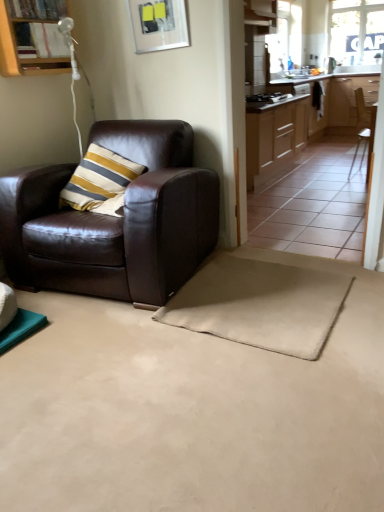
Question: Could you tell me if brown leather chair at right, which is the 2th chair from left to right, is turned towards shiny brown leather armchair at left, marked as the first chair in a bottom-to-top arrangement?

Choices:
 (A) no
 (B) yes

Answer: (A)

Question: From a real-world perspective, does brown leather chair at right, which is the 2th chair from left to right, sit lower than shiny brown leather armchair at left, marked as the first chair in a bottom-to-top arrangement?

Choices:
 (A) yes
 (B) no

Answer: (A)

Question: Does brown leather chair at right, which is the 2th chair from left to right, have a lesser height compared to shiny brown leather armchair at left, placed as the second chair when sorted from top to bottom?

Choices:
 (A) yes
 (B) no

Answer: (B)

Question: Is brown leather chair at right, the 1th chair positioned from the back, facing away from shiny brown leather armchair at left, marked as the first chair in a bottom-to-top arrangement?

Choices:
 (A) yes
 (B) no

Answer: (B)

Question: Is brown leather chair at right, the 2th chair when ordered from front to back, positioned in front of shiny brown leather armchair at left, placed as the second chair when sorted from top to bottom?

Choices:
 (A) yes
 (B) no

Answer: (B)

Question: Can you confirm if brown leather chair at right, which is counted as the 2th chair, starting from the bottom, is bigger than shiny brown leather armchair at left, marked as the first chair in a bottom-to-top arrangement?

Choices:
 (A) yes
 (B) no

Answer: (B)

Question: Considering the relative sizes of wooden cabinet at upper left, the third cabinetry when ordered from back to front, and white glossy sink at upper center in the image provided, is wooden cabinet at upper left, the third cabinetry when ordered from back to front, thinner than white glossy sink at upper center?

Choices:
 (A) no
 (B) yes

Answer: (B)

Question: Does wooden cabinet at upper left, which appears as the 1th cabinetry when viewed from the front, appear on the left side of white glossy sink at upper center?

Choices:
 (A) no
 (B) yes

Answer: (B)

Question: Is wooden cabinet at upper left, which appears as the 1th cabinetry when viewed from the front, facing away from white glossy sink at upper center?

Choices:
 (A) no
 (B) yes

Answer: (A)

Question: Can you confirm if wooden cabinet at upper left, which ranks as the 1th cabinetry in left-to-right order, is taller than white glossy sink at upper center?

Choices:
 (A) no
 (B) yes

Answer: (B)

Question: Is wooden cabinet at upper left, the third cabinetry when ordered from back to front, next to white glossy sink at upper center and touching it?

Choices:
 (A) yes
 (B) no

Answer: (B)

Question: Is wooden cabinet at upper left, which is the 3th cabinetry from right to left, shorter than white glossy sink at upper center?

Choices:
 (A) yes
 (B) no

Answer: (B)

Question: Can we say wooden cabinet at upper left, which is the 3th cabinetry from right to left, lies outside transparent glass window at upper right?

Choices:
 (A) no
 (B) yes

Answer: (B)